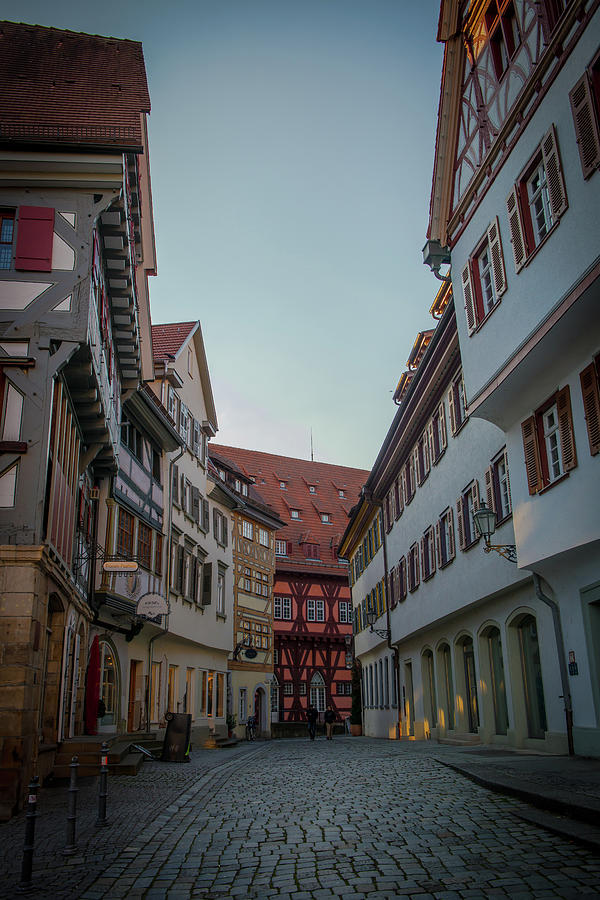
This screenshot has width=600, height=900. What are the coordinates of `light` in the screenshot? It's located at (370, 618), (484, 526).